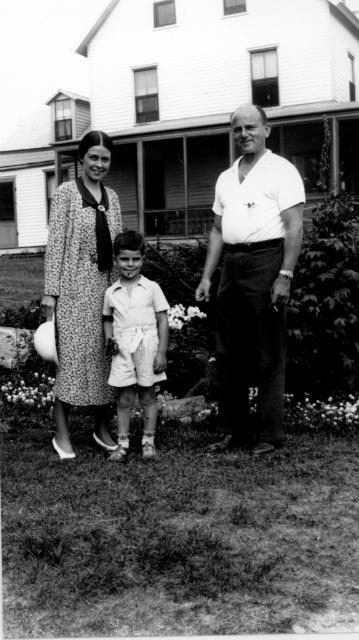
Does dress fabric woman at center lie in front of smooth white shorts at center?

Yes, dress fabric woman at center is in front of smooth white shorts at center.

Can you confirm if dress fabric woman at center is smaller than smooth white shorts at center?

Incorrect, dress fabric woman at center is not smaller in size than smooth white shorts at center.

Is point (273, 364) less distant than point (114, 321)?

Yes, it is.

You are a GUI agent. You are given a task and a screenshot of the screen. Output one action in this format:
    pyautogui.click(x=<x>, y=<y>)
    Task: Click on the dress fabric woman at center
    
    Given the screenshot: What is the action you would take?
    pyautogui.click(x=253, y=278)

Describe the element at coordinates (253, 276) in the screenshot. The width and height of the screenshot is (359, 640). I see `smooth white shirt at center` at that location.

Who is more forward, [239,396] or [109,276]?

Point [239,396]

You are a GUI agent. You are given a task and a screenshot of the screen. Output one action in this format:
    pyautogui.click(x=<x>, y=<y>)
    Task: Click on the smooth white shirt at center
    
    Given the screenshot: What is the action you would take?
    pyautogui.click(x=253, y=276)

Is point (240, 168) positioned after point (239, 312)?

No, (240, 168) is closer to viewer.

Between dress fabric woman at center and smooth white shirt at center, which one is positioned lower?

dress fabric woman at center

Who is more distant from viewer, (x=230, y=305) or (x=229, y=216)?

The point (x=230, y=305) is behind.

Identify the location of dress fabric woman at center. (253, 278).